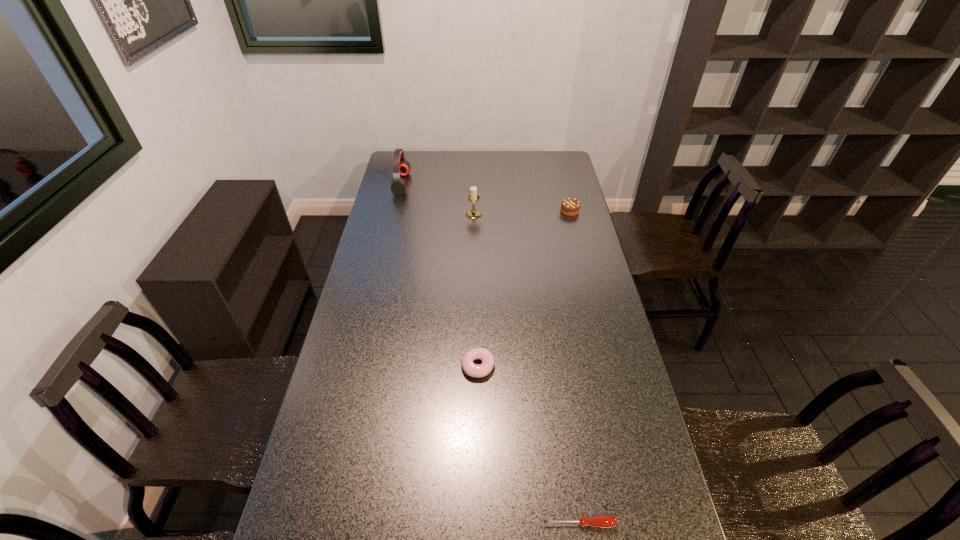
This screenshot has width=960, height=540. I want to click on the farthest object, so (401, 167).

You are a GUI agent. You are given a task and a screenshot of the screen. Output one action in this format:
    pyautogui.click(x=<x>, y=<y>)
    Task: Click on the leftmost object
    The width and height of the screenshot is (960, 540).
    Given the screenshot: What is the action you would take?
    pyautogui.click(x=401, y=167)

Image resolution: width=960 pixels, height=540 pixels. I want to click on the second tallest object, so click(473, 197).

Identify the location of the rightmost object. (569, 206).

The image size is (960, 540). In order to click on the third tallest object in this screenshot , I will do `click(569, 206)`.

Locate an element on the screen. doughnut is located at coordinates (477, 371).

Find the location of `the fourth farthest object`. the fourth farthest object is located at coordinates (477, 371).

You are a GUI agent. You are given a task and a screenshot of the screen. Output one action in this format:
    pyautogui.click(x=<x>, y=<y>)
    Task: Click on the shortest object
    Image resolution: width=960 pixels, height=540 pixels.
    Given the screenshot: What is the action you would take?
    pyautogui.click(x=604, y=521)

The height and width of the screenshot is (540, 960). Identify the location of the second object from right to left. (604, 521).

This screenshot has width=960, height=540. I want to click on vacant position located 0.220m on the ear cups of the earphone, so click(x=455, y=184).